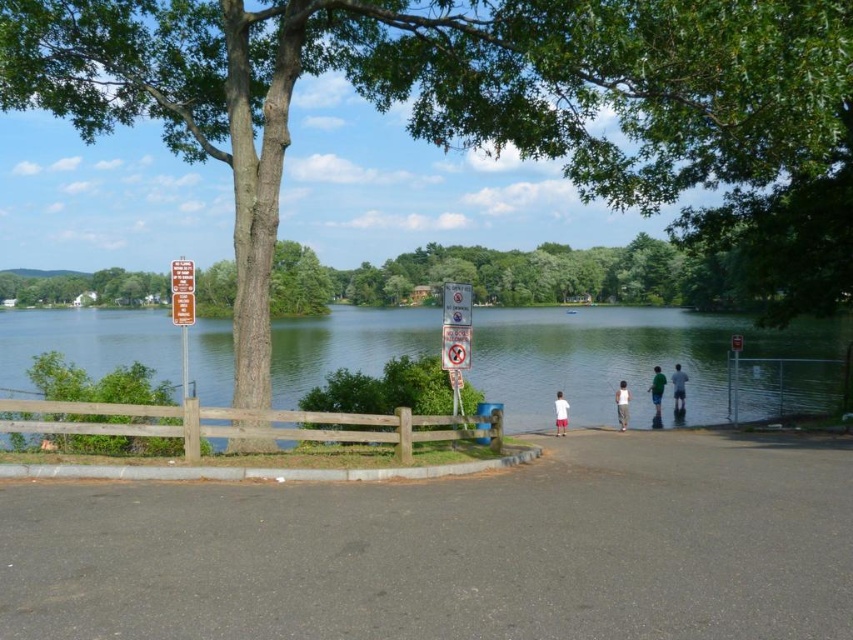
You are planning to take a photo of the green textured tree at center and the white plastic sign at upper center. Which object should you focus on first if you want both to be in sharp focus?

The green textured tree at center is bigger than the white plastic sign at upper center, so you should focus on the green textured tree at center first to ensure both are in sharp focus.

You are standing at the edge of the lake and see two points marked on the ground. The first point is at coordinates point (x=820, y=154) and the second is at point (x=679, y=401). Which point is closer to you?

Point (x=820, y=154) is in front of point (x=679, y=401), so it is closer to you.

From the picture: You are a photographer wanting to capture both the light blue shirt at center and the green cotton shirt at lower center in the same frame. Which shirt should you focus on first to ensure both are in the shot?

The light blue shirt at center is much taller than the green cotton shirt at lower center, so focusing on the light blue shirt at center first would ensure both are in the shot as it occupies a larger portion of the frame.